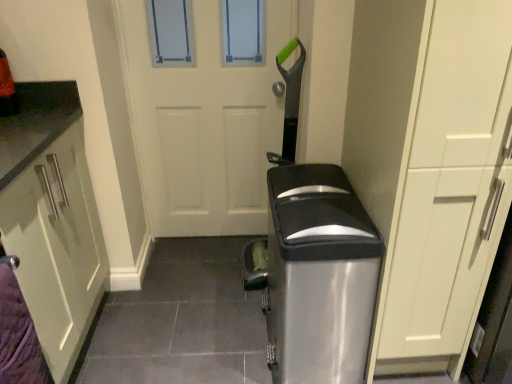
This screenshot has height=384, width=512. I want to click on matte white cabinet at left, so click(x=53, y=237).

Find the location of a particular element. This screenshot has width=512, height=384. home appliance on the left of matte white cabinet at right is located at coordinates (318, 276).

What's the angular difference between matte white cabinet at right and satin silver trash can at center's facing directions?

The angular difference between matte white cabinet at right and satin silver trash can at center is 88.4 degrees.

Can you confirm if matte white cabinet at right is taller than satin silver trash can at center?

Correct, matte white cabinet at right is much taller as satin silver trash can at center.

Between matte white cabinet at right and satin silver trash can at center, which one appears on the right side from the viewer's perspective?

Positioned to the right is matte white cabinet at right.

Considering the positions of objects satin silver trash can at center and matte white cabinet at right in the image provided, who is more to the left, satin silver trash can at center or matte white cabinet at right?

satin silver trash can at center.

From the picture: From the image's perspective, is satin silver trash can at center positioned above or below matte white cabinet at right?

Based on their image positions, satin silver trash can at center is located beneath matte white cabinet at right.

Which point is more distant from viewer, (336, 295) or (383, 193)?

The point (336, 295) is behind.

Is satin silver trash can at center turned away from matte white cabinet at right?

Result: Yes, satin silver trash can at center is positioned with its back facing matte white cabinet at right.

Considering the relative sizes of satin silver trash can at center and matte white cabinet at left in the image provided, is satin silver trash can at center taller than matte white cabinet at left?

No.

Looking at the image, does satin silver trash can at center seem bigger or smaller compared to matte white cabinet at left?

Clearly, satin silver trash can at center is smaller in size than matte white cabinet at left.

In the scene shown: Is satin silver trash can at center facing towards matte white cabinet at left?

Yes.

Can you confirm if satin silver trash can at center is positioned to the right of matte white cabinet at left?

Indeed, satin silver trash can at center is positioned on the right side of matte white cabinet at left.

How far apart are white matte door at center and satin silver trash can at center?

The distance of white matte door at center from satin silver trash can at center is 30.22 inches.

Considering the relative positions of white matte door at center and satin silver trash can at center in the image provided, is white matte door at center to the left or to the right of satin silver trash can at center?

From the image, it's evident that white matte door at center is to the left of satin silver trash can at center.

Could you tell me if white matte door at center is facing satin silver trash can at center?

Yes, white matte door at center is turned towards satin silver trash can at center.

Is white matte door at center in front of or behind satin silver trash can at center in the image?

white matte door at center is behind satin silver trash can at center.

How different are the orientations of satin silver trash can at center and white matte door at center in degrees?

The facing directions of satin silver trash can at center and white matte door at center are 87.6 degrees apart.

Would you consider satin silver trash can at center to be distant from white matte door at center?

That's not correct — satin silver trash can at center is a little close to white matte door at center.

Relative to white matte door at center, is satin silver trash can at center in front or behind?

satin silver trash can at center is positioned closer to the viewer than white matte door at center.

From a real-world perspective, is satin silver trash can at center above or below white matte door at center?

Clearly, from a real-world perspective, satin silver trash can at center is below white matte door at center.

Which object is positioned more to the right, white matte door at center or matte white cabinet at left?

white matte door at center is more to the right.

This screenshot has width=512, height=384. I want to click on door above the matte white cabinet at left (from the image's perspective), so click(206, 108).

Does white matte door at center contain matte white cabinet at left?

No, matte white cabinet at left is not surrounded by white matte door at center.

From a real-world perspective, is matte white cabinet at left positioned under satin silver trash can at center based on gravity?

No.

Based on the photo, does matte white cabinet at left contain satin silver trash can at center?

Actually, satin silver trash can at center is outside matte white cabinet at left.

Considering the sizes of objects matte white cabinet at left and satin silver trash can at center in the image provided, who is thinner, matte white cabinet at left or satin silver trash can at center?

satin silver trash can at center is thinner.

From the image's perspective, is matte white cabinet at left located above or below satin silver trash can at center?

Based on their image positions, matte white cabinet at left is located above satin silver trash can at center.

You are a GUI agent. You are given a task and a screenshot of the screen. Output one action in this format:
    pyautogui.click(x=<x>, y=<y>)
    Task: Click on the home appliance lying on the left of matte white cabinet at right
    
    Given the screenshot: What is the action you would take?
    pyautogui.click(x=318, y=276)

Locate an element on the screen. dresser that appears above the satin silver trash can at center (from a real-world perspective) is located at coordinates (430, 167).

From the image, which object appears to be nearer to white matte door at center, matte white cabinet at right or satin silver trash can at center?

satin silver trash can at center.

Considering their positions, is white matte door at center positioned closer to satin silver trash can at center than matte white cabinet at right?

matte white cabinet at right lies closer to satin silver trash can at center than the other object.

Looking at the image, which one is located closer to white matte door at center, satin silver trash can at center or matte white cabinet at left?

Among the two, matte white cabinet at left is located nearer to white matte door at center.

Estimate the real-world distances between objects in this image. Which object is closer to white matte door at center, matte white cabinet at left or matte white cabinet at right?

matte white cabinet at left.

When comparing their distances from matte white cabinet at right, does satin silver trash can at center or matte white cabinet at left seem further?

matte white cabinet at left is positioned further to the anchor matte white cabinet at right.

Looking at the image, which one is located closer to matte white cabinet at left, matte white cabinet at right or white matte door at center?

Among the two, white matte door at center is located nearer to matte white cabinet at left.

Looking at the image, which one is located further to matte white cabinet at left, white matte door at center or satin silver trash can at center?

Based on the image, satin silver trash can at center appears to be further to matte white cabinet at left.

Estimate the real-world distances between objects in this image. Which object is closer to matte white cabinet at left, matte white cabinet at right or satin silver trash can at center?

satin silver trash can at center is closer to matte white cabinet at left.

Where is `home appliance situated between white matte door at center and matte white cabinet at right from left to right`? This screenshot has width=512, height=384. home appliance situated between white matte door at center and matte white cabinet at right from left to right is located at coordinates (318, 276).

This screenshot has height=384, width=512. I want to click on door situated between matte white cabinet at left and satin silver trash can at center from left to right, so click(206, 108).

Where is `door between matte white cabinet at left and matte white cabinet at right`? The image size is (512, 384). door between matte white cabinet at left and matte white cabinet at right is located at coordinates (206, 108).

Locate an element on the screen. The height and width of the screenshot is (384, 512). home appliance between matte white cabinet at left and matte white cabinet at right is located at coordinates (318, 276).